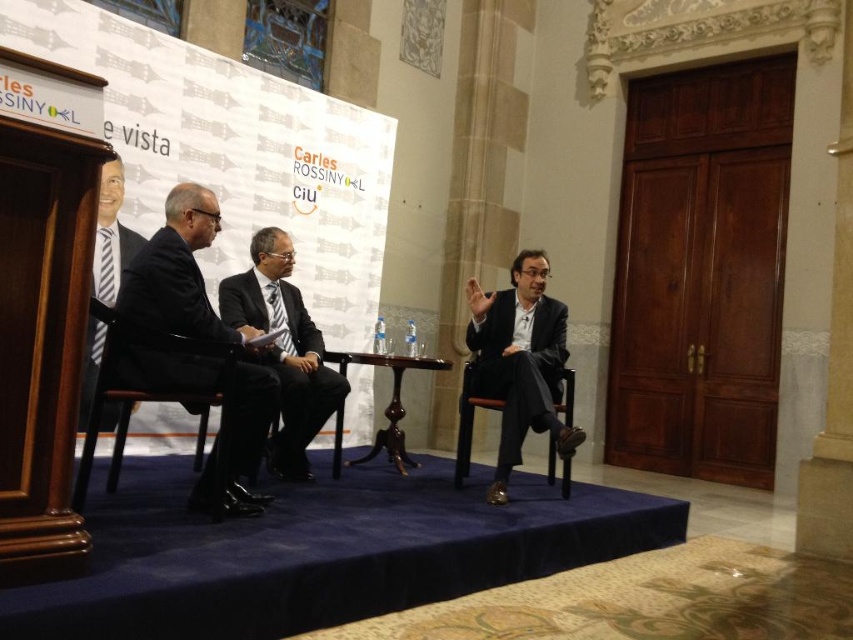
You are an event planner arranging a photo shoot for the panel discussion. You need to ensure that the dark suit at left and the black leather chair at center are both visible in the frame. Given their sizes, which object should you prioritize placing closer to the camera to maintain clarity?

The dark suit at left is wider than the black leather chair at center, so you should prioritize placing the dark suit at left closer to the camera to ensure its details remain clear.

You are attending a formal event in a grand hall with a stage. You notice a point marked at coordinates (520, 360). What object is located at that specific coordinate?

The object at point (520, 360) is the matte black suit at center.